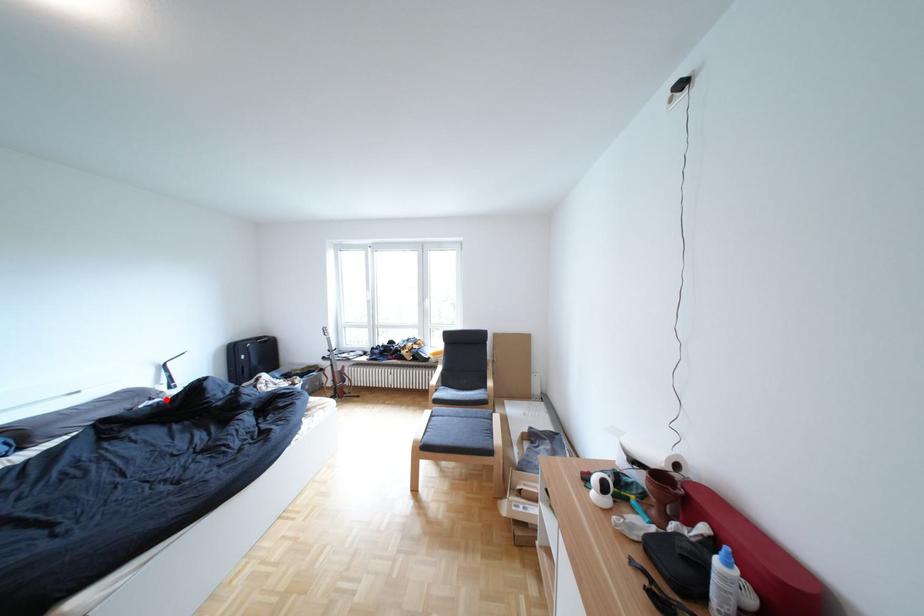
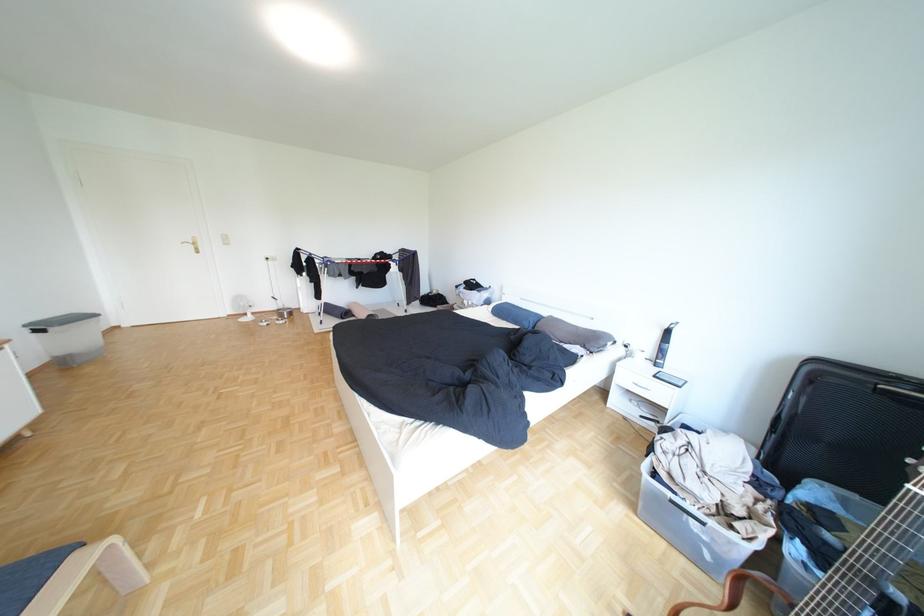
The point at the highlighted location is marked in the first image. Where is the corresponding point in the second image?

(600, 347)